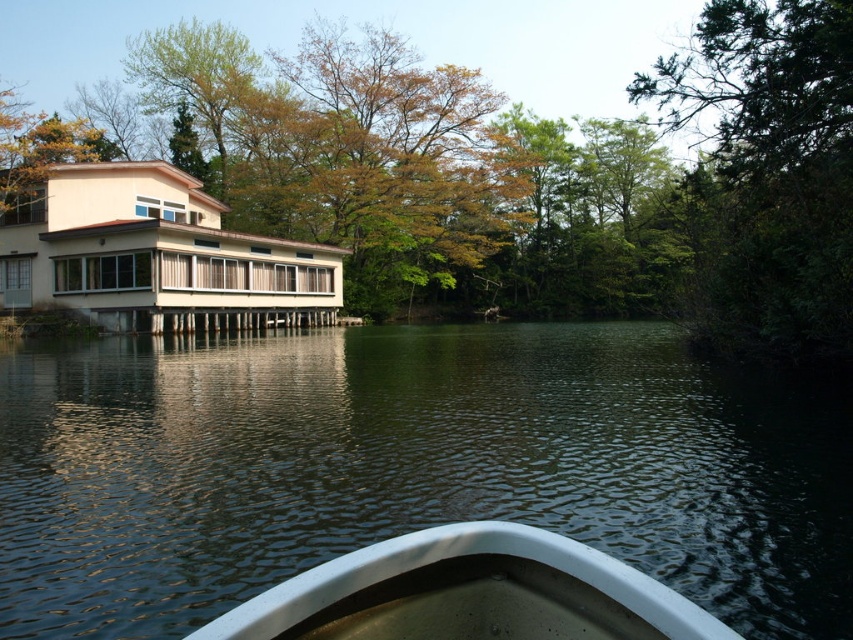
You are sitting in the boat and looking at two points in the scene. One is labeled as point 1 at coordinates point (566,412) and the other is point 2 at coordinates point (486,627). Which point is closer to your eyes?

Point 1 at coordinates point (566,412) is closer to your eyes because it is further to the camera than point 2 at coordinates point (486,627).

You are sitting in a boat on a serene lake. You notice a point marked at coordinates [469,593]. What object is located at that point?

The white glossy boat at center is located at point [469,593].